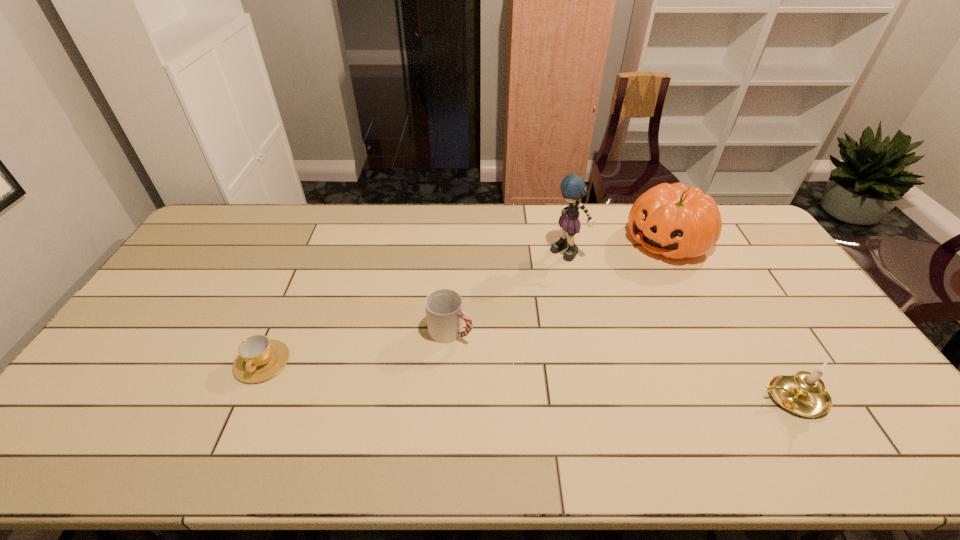
At what (x,y) coordinates should I click in order to perform the action: click on vacant space on the desktop that is between the left cup and the candle holder and is positioned on the front-facing side of the tallest object. Please return your answer as a coordinate pair (x, y). Looking at the image, I should click on (460, 375).

Where is `free space on the desktop that is between the leftmost object and the third tallest object and is positioned on the carved face of the fourth shortest object`? Image resolution: width=960 pixels, height=540 pixels. free space on the desktop that is between the leftmost object and the third tallest object and is positioned on the carved face of the fourth shortest object is located at coordinates (496, 377).

The image size is (960, 540). I want to click on vacant space on the desktop that is between the left cup and the third tallest object and is positioned on the side of the right cup where the handle is located, so click(x=538, y=380).